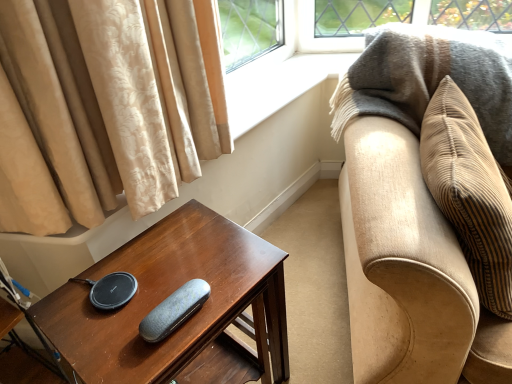
Question: Can textured gray case at center be found inside beige corduroy couch at right?

Choices:
 (A) no
 (B) yes

Answer: (A)

Question: Is beige corduroy couch at right smaller than textured gray case at center?

Choices:
 (A) yes
 (B) no

Answer: (B)

Question: Is beige corduroy couch at right taller than textured gray case at center?

Choices:
 (A) yes
 (B) no

Answer: (A)

Question: Is textured gray case at center at the back of beige corduroy couch at right?

Choices:
 (A) yes
 (B) no

Answer: (B)

Question: Is beige corduroy couch at right to the left of textured gray case at center from the viewer's perspective?

Choices:
 (A) no
 (B) yes

Answer: (A)

Question: From the image's perspective, is beige corduroy couch at right located beneath textured gray case at center?

Choices:
 (A) yes
 (B) no

Answer: (B)

Question: Is dark brown wood table at lower left smaller than textured gray case at center?

Choices:
 (A) no
 (B) yes

Answer: (A)

Question: Is dark brown wood table at lower left not within textured gray case at center?

Choices:
 (A) yes
 (B) no

Answer: (A)

Question: Is textured gray case at center inside dark brown wood table at lower left?

Choices:
 (A) yes
 (B) no

Answer: (A)

Question: Considering the relative positions of dark brown wood table at lower left and textured gray case at center in the image provided, is dark brown wood table at lower left to the left of textured gray case at center from the viewer's perspective?

Choices:
 (A) no
 (B) yes

Answer: (B)

Question: From the image's perspective, is dark brown wood table at lower left under textured gray case at center?

Choices:
 (A) no
 (B) yes

Answer: (B)

Question: Considering the relative sizes of dark brown wood table at lower left and textured gray case at center in the image provided, is dark brown wood table at lower left shorter than textured gray case at center?

Choices:
 (A) yes
 (B) no

Answer: (B)

Question: Can you confirm if beige corduroy couch at right is thinner than beige corduroy pillow at right?

Choices:
 (A) yes
 (B) no

Answer: (B)